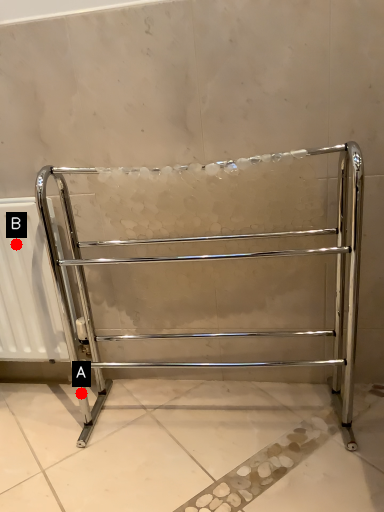
Question: Two points are circled on the image, labeled by A and B beside each circle. Which point is further to the camera?

Choices:
 (A) A is further
 (B) B is further

Answer: (A)